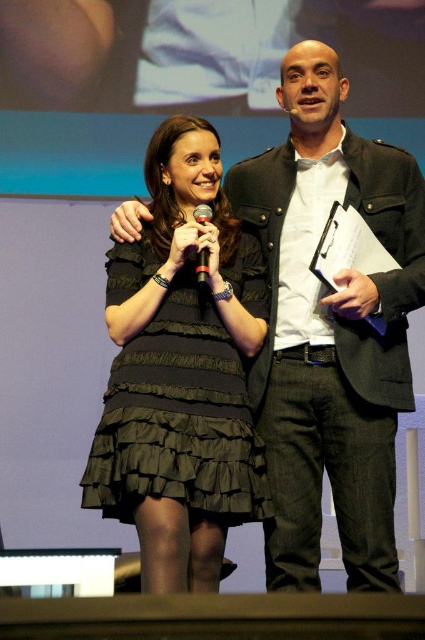
Can you confirm if black textured dress at center is wider than black matte microphone at center?

Indeed, black textured dress at center has a greater width compared to black matte microphone at center.

At what (x,y) coordinates should I click in order to perform the action: click on black textured dress at center. Please return your answer as a coordinate pair (x, y). The height and width of the screenshot is (640, 425). Looking at the image, I should click on (178, 419).

Locate an element on the screen. The image size is (425, 640). black textured dress at center is located at coordinates (178, 419).

Based on the photo, who is taller, matte black jacket at center or black matte microphone at center?

Standing taller between the two is matte black jacket at center.

Between matte black jacket at center and black matte microphone at center, which one appears on the left side from the viewer's perspective?

From the viewer's perspective, black matte microphone at center appears more on the left side.

Which is behind, point (345, 556) or point (201, 224)?

The point (345, 556) is more distant.

Find the location of a particular element. matte black jacket at center is located at coordinates (331, 328).

Who is positioned more to the right, matte black jacket at center or black textured dress at center?

matte black jacket at center

Is point (411, 307) more distant than point (121, 300)?

No, it is in front of (121, 300).

Image resolution: width=425 pixels, height=640 pixels. Describe the element at coordinates (331, 328) in the screenshot. I see `matte black jacket at center` at that location.

Locate an element on the screen. The width and height of the screenshot is (425, 640). matte black jacket at center is located at coordinates (331, 328).